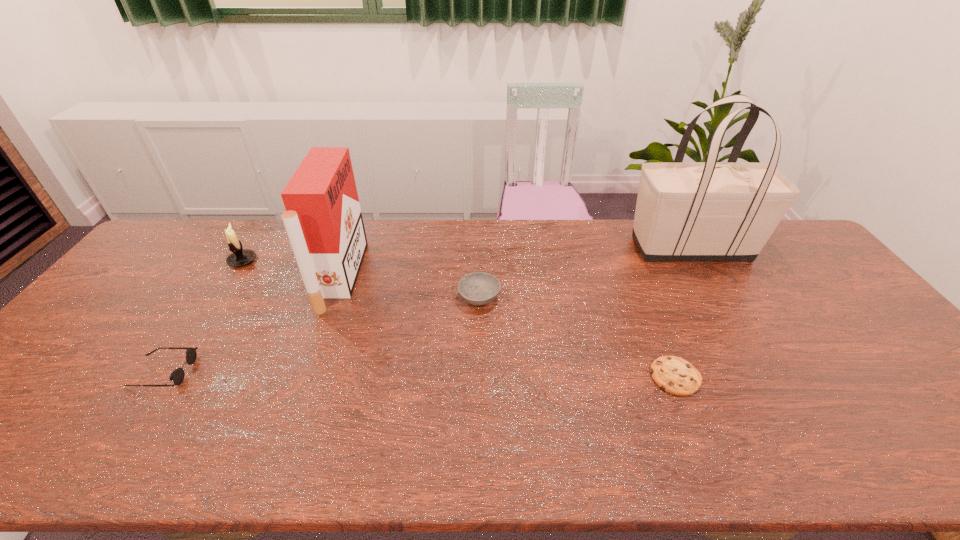
You are a GUI agent. You are given a task and a screenshot of the screen. Output one action in this format:
    pyautogui.click(x=<x>, y=<y>)
    Task: Click on the shopping bag
    The height and width of the screenshot is (540, 960).
    Given the screenshot: What is the action you would take?
    pyautogui.click(x=693, y=211)

Where is `the fifth shortest object`? The image size is (960, 540). the fifth shortest object is located at coordinates (323, 219).

Identify the location of cigarette case. (323, 219).

Where is `the fourth shortest object`? This screenshot has height=540, width=960. the fourth shortest object is located at coordinates tap(240, 257).

The height and width of the screenshot is (540, 960). In order to click on the fourth object from left to right in this screenshot , I will do `click(479, 288)`.

Find the location of a particular element. sunglasses is located at coordinates (177, 376).

The width and height of the screenshot is (960, 540). What are the coordinates of `the shortest object` in the screenshot? It's located at (674, 375).

Where is `vacant region located 0.360m with handles facing forward on the shopping bag`? This screenshot has height=540, width=960. vacant region located 0.360m with handles facing forward on the shopping bag is located at coordinates (520, 248).

Locate an element on the screen. This screenshot has height=540, width=960. free region located with handles facing forward on the shopping bag is located at coordinates (523, 248).

Find the location of a particular element. The height and width of the screenshot is (540, 960). vacant space located with handles facing forward on the shopping bag is located at coordinates (517, 248).